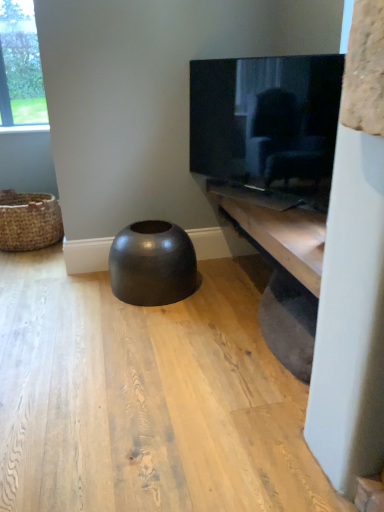
Question: In the image, is matte black tv at upper right positioned in front of or behind wooden shelf at lower right?

Choices:
 (A) front
 (B) behind

Answer: (B)

Question: Looking at the image, does matte black tv at upper right seem bigger or smaller compared to wooden shelf at lower right?

Choices:
 (A) big
 (B) small

Answer: (B)

Question: Which of these objects is positioned farthest from the brown woven basket at left?

Choices:
 (A) glossy black stool at center
 (B) wooden shelf at lower right
 (C) matte black tv at upper right

Answer: (B)

Question: Considering the real-world distances, which object is farthest from the glossy black stool at center?

Choices:
 (A) wooden shelf at lower right
 (B) matte black tv at upper right
 (C) brown woven basket at left

Answer: (C)